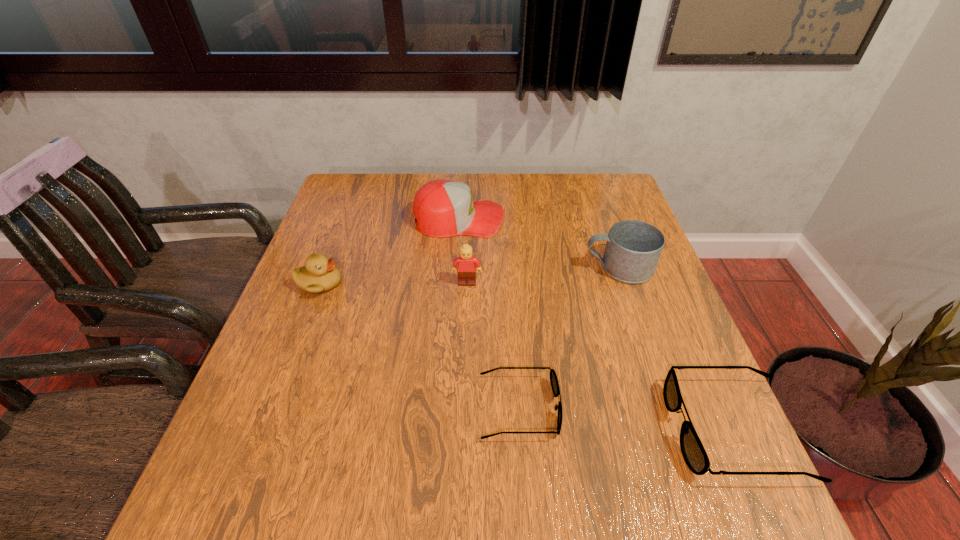
I want to click on the shorter spectacles, so click(553, 377).

At what (x,y) coordinates should I click in order to perform the action: click on the shortest object. Please return your answer as a coordinate pair (x, y). Looking at the image, I should click on (553, 377).

Locate an element on the screen. the second shortest object is located at coordinates (693, 451).

The height and width of the screenshot is (540, 960). In order to click on the taller spectacles in this screenshot , I will do `click(693, 451)`.

Identify the location of the farthest object. Image resolution: width=960 pixels, height=540 pixels. (443, 208).

At what (x,y) coordinates should I click in order to perform the action: click on Lego. Please return your answer as a coordinate pair (x, y). Looking at the image, I should click on (467, 269).

Locate an element on the screen. duckling is located at coordinates (319, 275).

Locate an element on the screen. Image resolution: width=960 pixels, height=540 pixels. mug is located at coordinates (633, 248).

Image resolution: width=960 pixels, height=540 pixels. Find the location of `vacant space located on the front-facing side of the shortest object`. vacant space located on the front-facing side of the shortest object is located at coordinates (641, 408).

The width and height of the screenshot is (960, 540). Identify the location of free spot located on the front-facing side of the fifth tallest object. (645, 429).